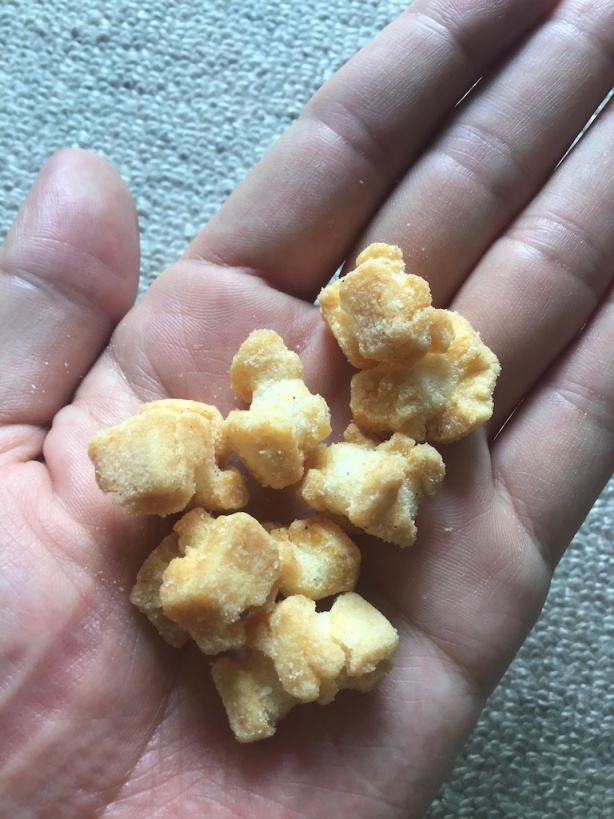
What are the coordinates of `carpet` in the screenshot? It's located at (218, 89).